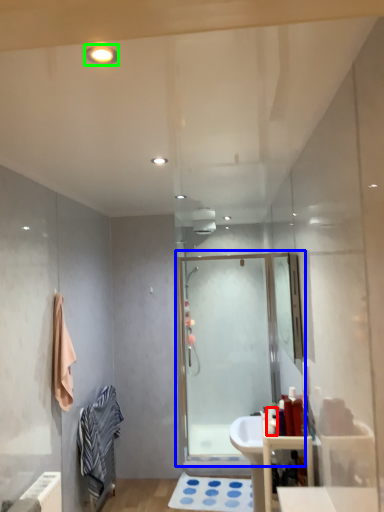
Question: Which object is the farthest from toiletry (highlighted by a red box)? Choose among these: screen door (highlighted by a blue box) or light fixture (highlighted by a green box).

Choices:
 (A) screen door
 (B) light fixture

Answer: (B)